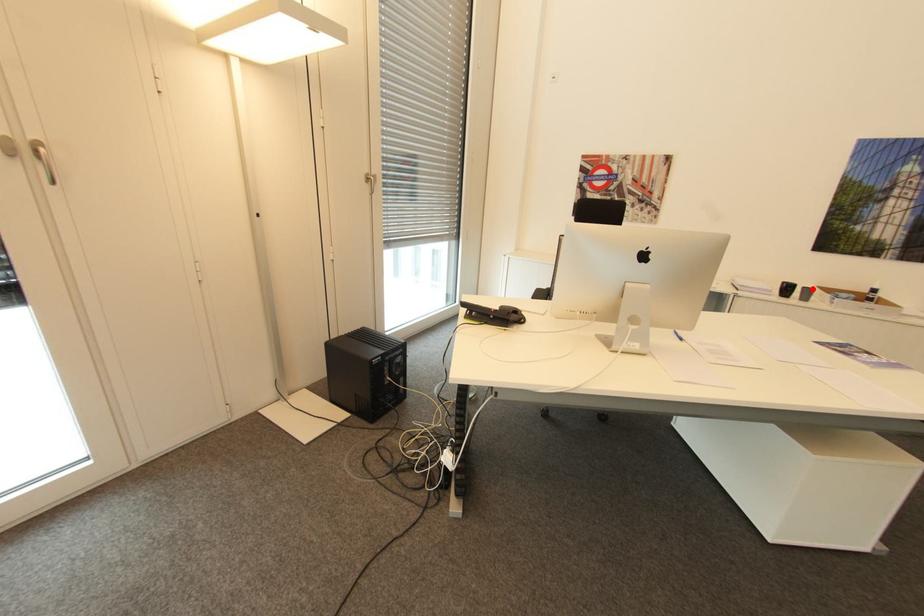
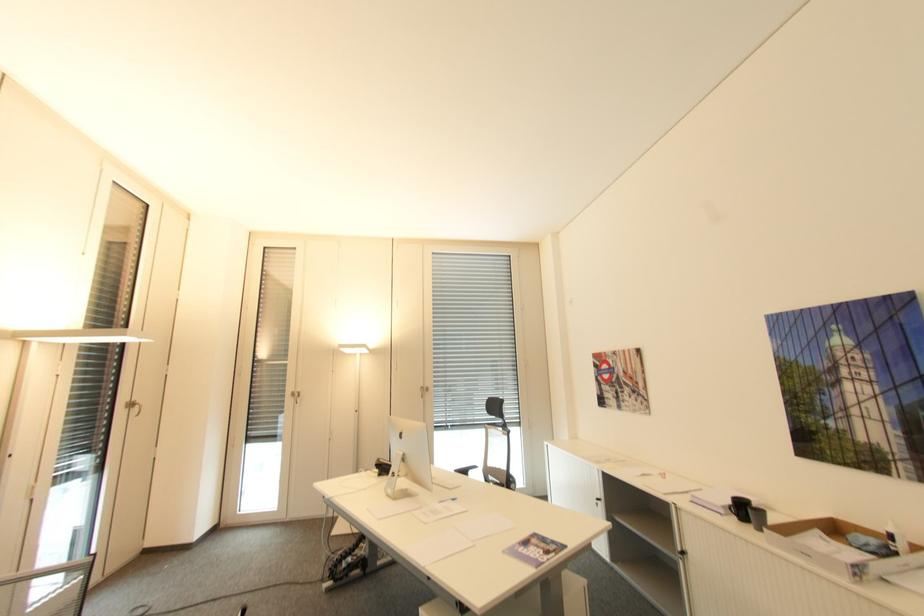
In the second image, find the point that corresponds to the highlighted location in the first image.

(766, 513)